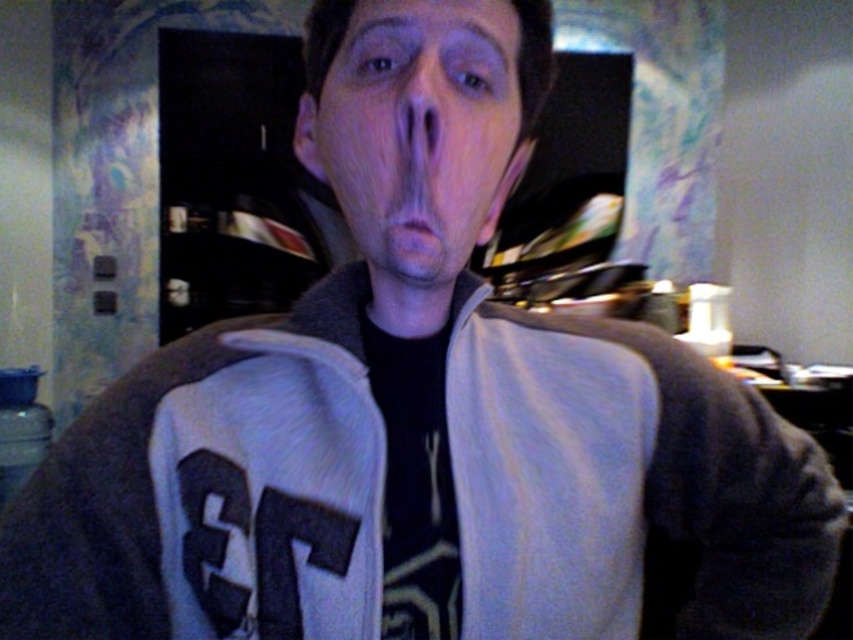
Consider the image. You are an artist trying to sketch this scene. The matte skin face at center is located at coordinates point 0.202, 0.492. If you want to draw the face precisely, what are the coordinates you should use?

The coordinates for the matte skin face at center are point (419, 129).

You are a photographer adjusting the focus on your camera. You want to ensure both the matte skin face at center and the smooth skin nose at center are in sharp focus. Given that your camera has a depth of field that can cover objects within 5 centimeters of each other, will both be in focus?

The distance between the matte skin face at center and the smooth skin nose at center is 4.65 centimeters, which is within the 5 centimeter depth of field range. Therefore, both will be in sharp focus.

You are standing in front of a person wearing a jacket with ET on the back. The person has a matte skin face at center. If you want to hand them a document without moving closer than 12 inches, can you reach them?

The matte skin face at center is 13.32 inches away from the viewer, so yes, you can hand them the document without moving closer than 12 inches since the distance is sufficient.